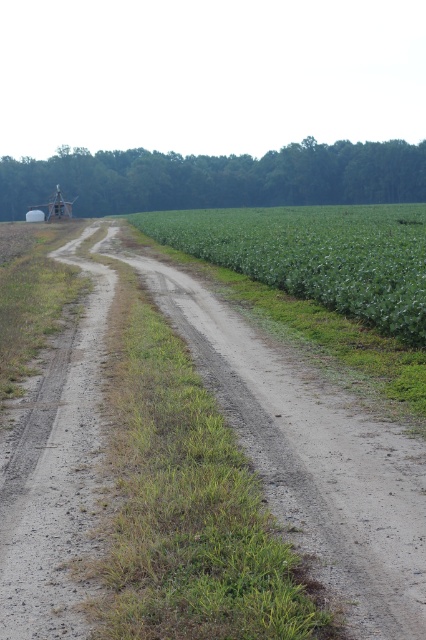
You are standing on the dirt road in the rural scene and want to walk to a specific location. You have two options to choose from, marked as point 1 at coordinates point (313, 412) and point 2 at coordinates point (389, 262). Which point would you reach first if you start walking straight ahead from your current position on the road?

Point (313, 412) is closer to the viewer than point (389, 262), so you will reach point (313, 412) first.

You are driving a tractor that is 3 meters wide. You need to cross the area shown in the image. Can your tractor safely pass through the dusty gravel road at center without encroaching into the green leafy corn field at center?

The dusty gravel road at center is narrower than the green leafy corn field at center. Since your tractor is 3 meters wide, it may not fit safely on the road if the road is narrower than 3 meters. You should check the road width before proceeding.

You are a farmer driving a tractor that is 2 meters wide. You are on the dusty gravel road at center and want to pass under the green leafy corn field at center. Can your tractor fit under the corn field without hitting it?

The dusty gravel road at center is positioned under the green leafy corn field at center, so the tractor may not fit under the corn field as the road is below it. You should check the clearance height before proceeding.